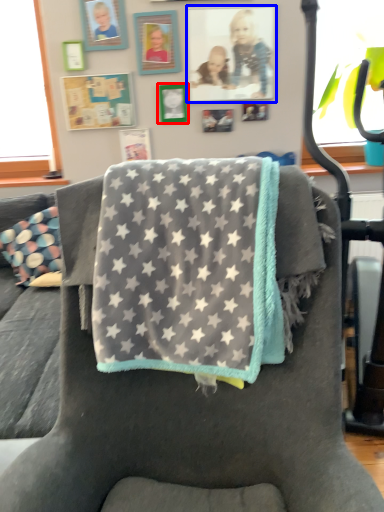
Question: Which of the following is the farthest to the observer, picture frame (highlighted by a red box) or picture frame (highlighted by a blue box)?

Choices:
 (A) picture frame
 (B) picture frame

Answer: (A)